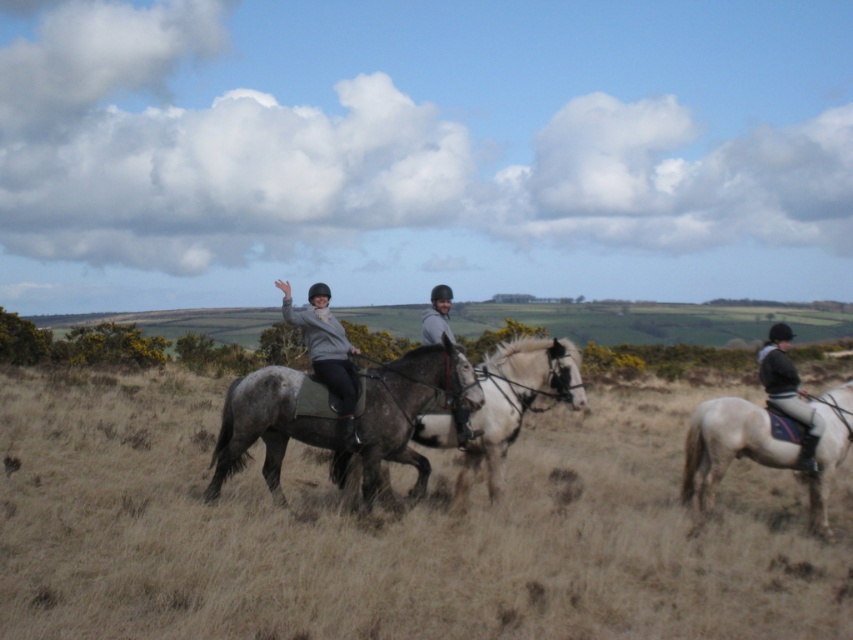
Question: Is white glossy horse at right further to the viewer compared to dark gray leather jacket at right?

Choices:
 (A) yes
 (B) no

Answer: (B)

Question: Does dry grass at center appear over white glossy horse at center?

Choices:
 (A) yes
 (B) no

Answer: (B)

Question: Which point appears farthest from the camera in this image?

Choices:
 (A) (543, 385)
 (B) (346, 380)
 (C) (80, 529)
 (D) (747, 458)

Answer: (D)

Question: In this image, where is gray matte horse at center located relative to matte gray jacket at center?

Choices:
 (A) above
 (B) below

Answer: (B)

Question: Which point is farther to the camera?

Choices:
 (A) dry grass at center
 (B) matte gray jacket at center
 (C) white glossy horse at center

Answer: (C)

Question: Which object is the farthest from the dry grass at center?

Choices:
 (A) dark gray leather jacket at right
 (B) white glossy horse at right

Answer: (A)